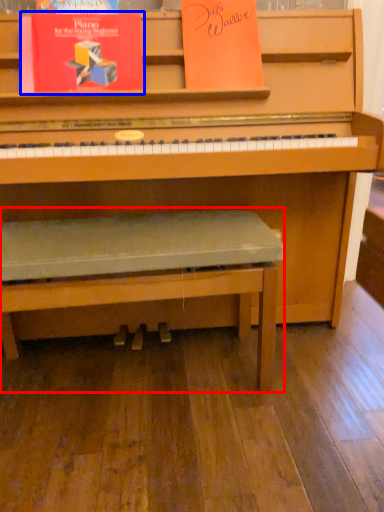
Question: Among these objects, which one is nearest to the camera, church bench (highlighted by a red box) or paperback book (highlighted by a blue box)?

Choices:
 (A) church bench
 (B) paperback book

Answer: (A)